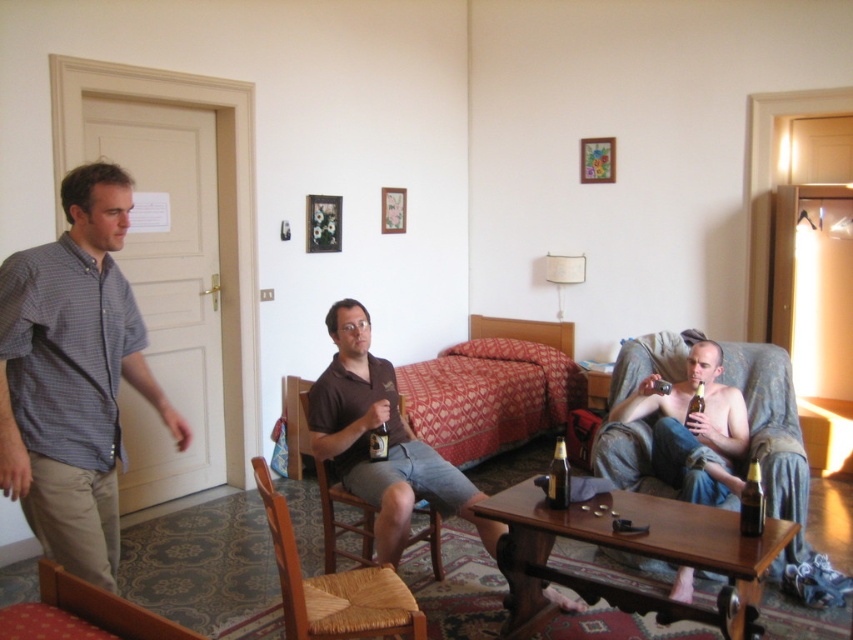
Is brown glass bottle at coffee table below matte glass beer at center?

Correct, brown glass bottle at coffee table is located below matte glass beer at center.

Does brown glass bottle at coffee table have a lesser width compared to matte glass beer at center?

No.

Where is `brown glass bottle at coffee table`? This screenshot has width=853, height=640. brown glass bottle at coffee table is located at coordinates (751, 502).

Which is behind, point (782, 472) or point (699, 385)?

The point (699, 385) is more distant.

You are a GUI agent. You are given a task and a screenshot of the screen. Output one action in this format:
    pyautogui.click(x=<x>, y=<y>)
    Task: Click on the denim fabric couch at lower right
    
    Given the screenshot: What is the action you would take?
    pyautogui.click(x=773, y=435)

At what (x,y) coordinates should I click in order to perform the action: click on denim fabric couch at lower right. Please return your answer as a coordinate pair (x, y). Looking at the image, I should click on (773, 435).

Does point (495, 536) lie behind point (770, 410)?

No, it is not.

This screenshot has height=640, width=853. Describe the element at coordinates (387, 440) in the screenshot. I see `brown cotton shirt at center` at that location.

Who is more forward, (x=490, y=547) or (x=782, y=451)?

Point (x=490, y=547) is in front.

The height and width of the screenshot is (640, 853). Identify the location of brown cotton shirt at center. (387, 440).